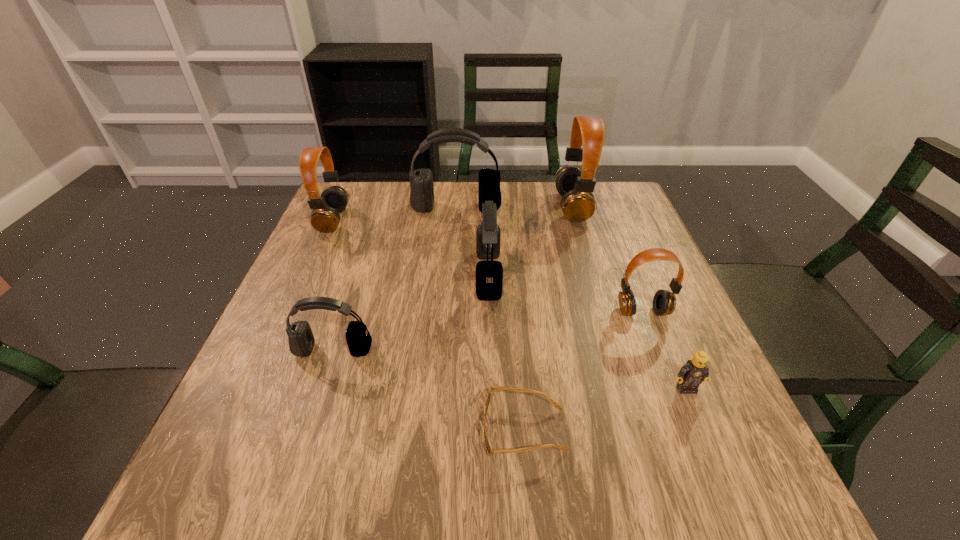
Find the location of a particular element. The width and height of the screenshot is (960, 540). the biggest brown headset is located at coordinates (575, 185).

This screenshot has height=540, width=960. In order to click on the biggest black headset in this screenshot , I will do `click(421, 199)`.

At what (x,y) coordinates should I click in order to perform the action: click on the leftmost headset. Please return your answer as a coordinate pair (x, y). The width and height of the screenshot is (960, 540). Looking at the image, I should click on (325, 217).

Find the location of a particular element. the leftmost brown headset is located at coordinates (325, 217).

The width and height of the screenshot is (960, 540). I want to click on the second biggest black headset, so pos(489,274).

Identify the location of the smallest brown headset. This screenshot has width=960, height=540. (664, 302).

Identify the location of the nearest headset. The image size is (960, 540). (301, 340).

You are a GUI agent. You are given a task and a screenshot of the screen. Output one action in this format:
    pyautogui.click(x=<x>, y=<y>)
    Task: Click on the seventh object from right to left
    The width and height of the screenshot is (960, 540).
    Given the screenshot: What is the action you would take?
    pyautogui.click(x=301, y=340)

Image resolution: width=960 pixels, height=540 pixels. Identify the location of tan Lego. (691, 374).

Locate an element on the screen. Lego is located at coordinates point(691,374).